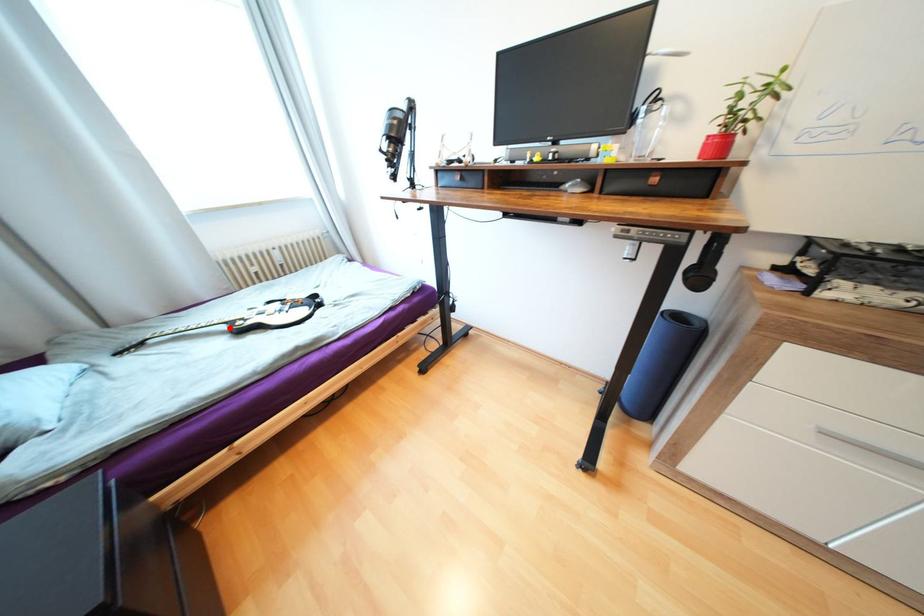
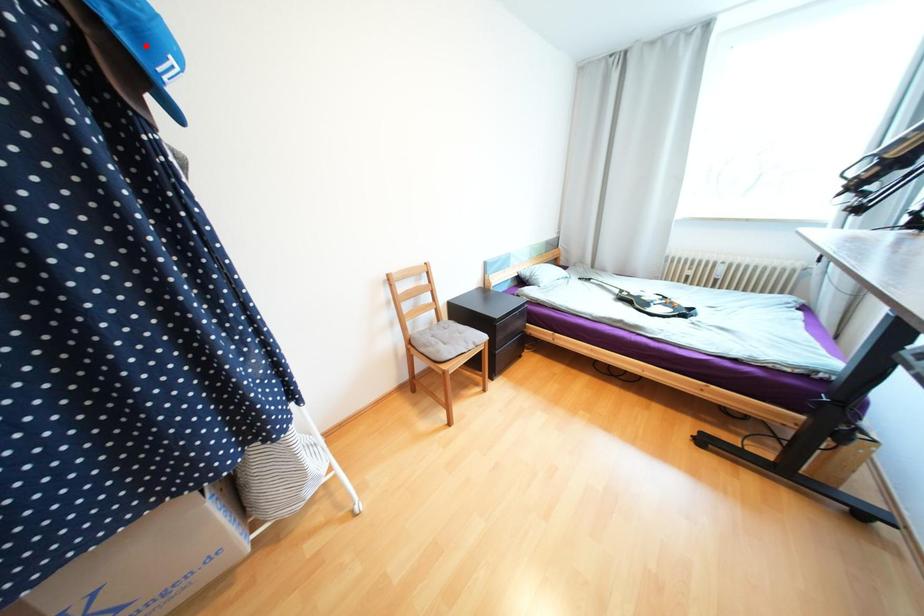
I am providing you with two images of the same scene from different viewpoints. A red point is marked on the first image and another point is marked on the second image. Is the red point in image1 aligned with the point shown in image2?

No